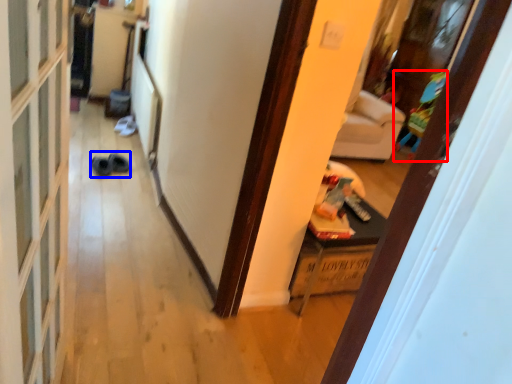
Question: Which object appears farthest to the camera in this image, toy (highlighted by a red box) or shoe (highlighted by a blue box)?

Choices:
 (A) toy
 (B) shoe

Answer: (A)